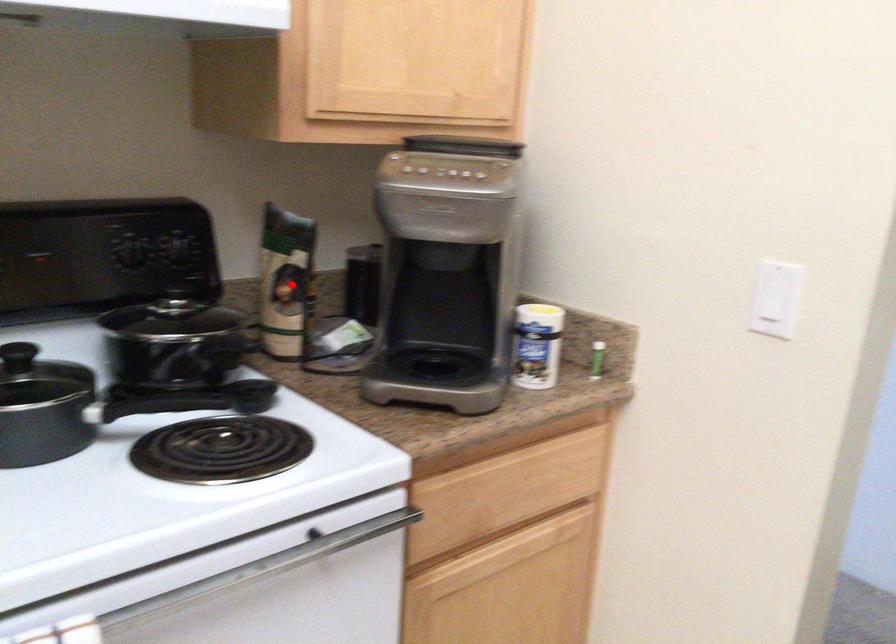
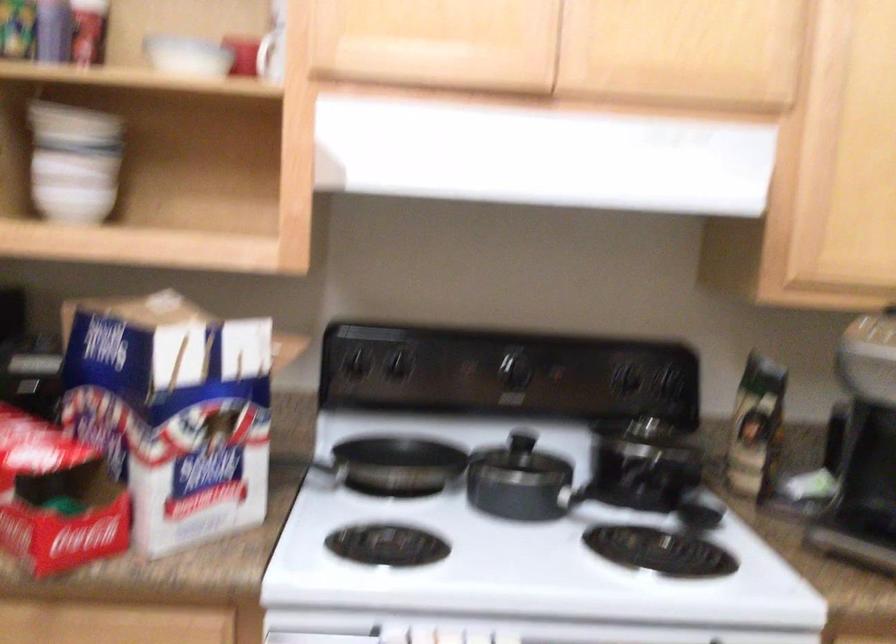
In the second image, find the point that corresponds to the highlighted location in the first image.

(755, 426)